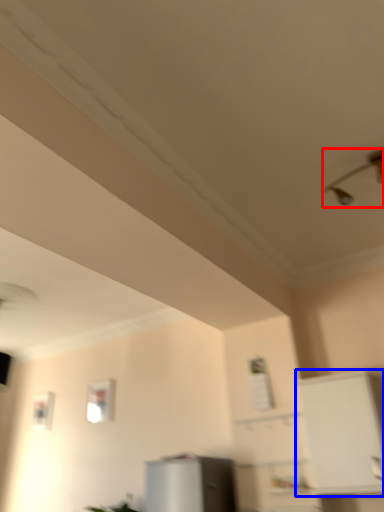
Question: Among these objects, which one is farthest to the camera, light fixture (highlighted by a red box) or cabinetry (highlighted by a blue box)?

Choices:
 (A) light fixture
 (B) cabinetry

Answer: (B)